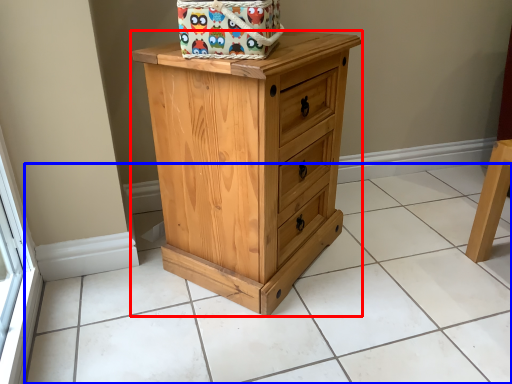
Question: Which object appears farthest to the camera in this image, chest of drawers (highlighted by a red box) or tile (highlighted by a blue box)?

Choices:
 (A) chest of drawers
 (B) tile

Answer: (A)